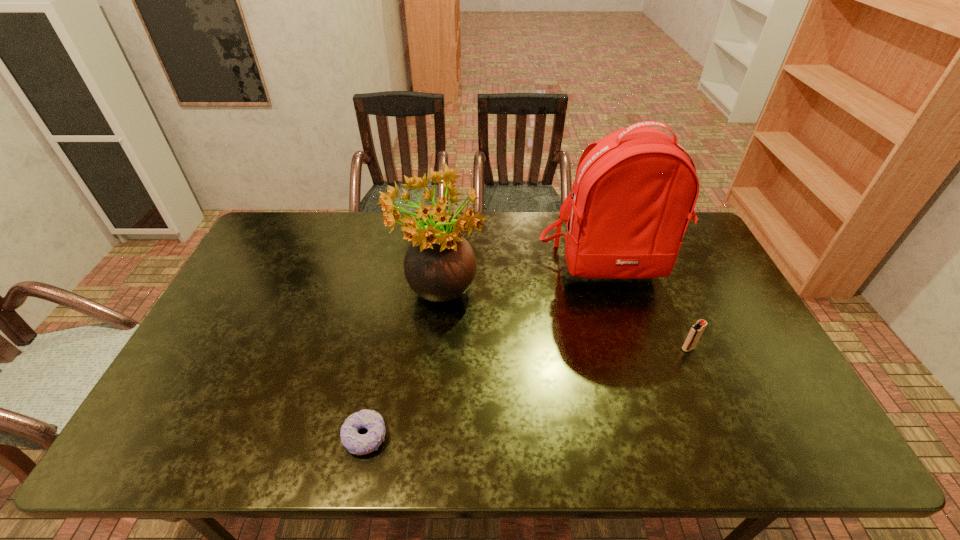
Locate an element on the screen. free space between the backpack and the third shortest object is located at coordinates (523, 282).

Identify the location of vacant space that is in between the third farthest object and the nearest object. Image resolution: width=960 pixels, height=540 pixels. click(x=527, y=393).

Locate an element on the screen. The width and height of the screenshot is (960, 540). vacant area that lies between the tallest object and the nearest object is located at coordinates (487, 352).

Identify the location of vacant space in between the tallest object and the second nearest object. The image size is (960, 540). (648, 308).

Identify the location of free space between the shortest object and the backpack. This screenshot has width=960, height=540. (487, 352).

I want to click on free point between the third tallest object and the tallest object, so click(648, 308).

Find the location of a particular element. The width and height of the screenshot is (960, 540). vacant area that lies between the backpack and the igniter is located at coordinates (648, 308).

At what (x,y) coordinates should I click in order to perform the action: click on vacant space in between the flower arrangement and the nearest object. Please return your answer as a coordinate pair (x, y). This screenshot has width=960, height=540. Looking at the image, I should click on (402, 367).

Where is `free spot between the igniter and the tallest object`? free spot between the igniter and the tallest object is located at coordinates (648, 308).

Locate which object ranks second in proximity to the shortest object. Please provide its 2D coordinates. Your answer should be formatted as a tuple, i.e. [(x, y)], where the tuple contains the x and y coordinates of a point satisfying the conditions above.

[(635, 190)]